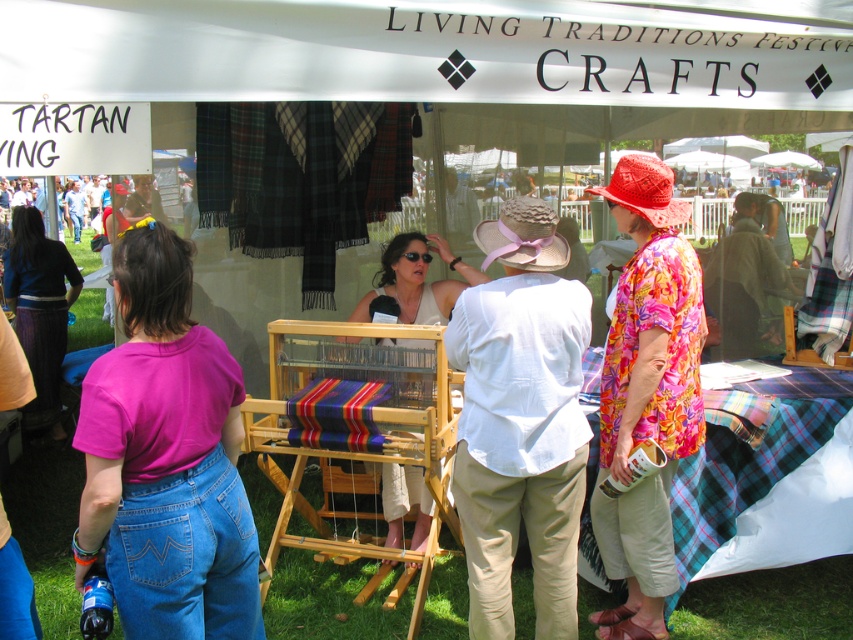
You are a festival attendee who wants to take a photo of both the white cotton hat at center and the floral fabric shirt at right without moving either item. What is the minimum distance you need to step back to ensure both are fully visible in your camera frame?

The minimum distance you need to step back is 47.11 centimeters to ensure both the white cotton hat at center and the floral fabric shirt at right are fully visible in your camera frame.

You are a visitor at the festival and want to take a photo of both the pink cotton shirt at center and the matte blue sweater at center. Can you fit both items in your camera frame if your camera has a maximum width of 15 feet?

The pink cotton shirt at center and matte blue sweater at center are 13.62 feet apart from each other. Since the distance between them is less than the camera frame width of 15 feet, you can fit both items in the frame.

You are standing at the entrance of the LIVING TRADITIONS FESTIVAL CRAFTS and see the white cotton hat at center. If you want to touch it, how many steps do you need to take if each step is 3 feet long?

The white cotton hat at center is 8.99 feet away from the viewer. Since each step is 3 feet long, you would need to take approximately 3 steps to reach it, as 3 steps would cover 9 feet, which is slightly more than the distance required.